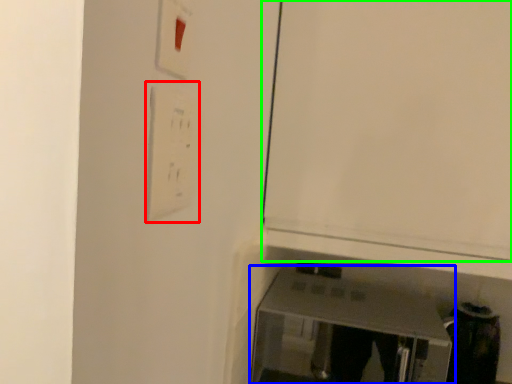
Question: Based on their relative distances, which object is farther from light switch (highlighted by a red box)? Choose from furniture (highlighted by a blue box) and door (highlighted by a green box).

Choices:
 (A) furniture
 (B) door

Answer: (A)